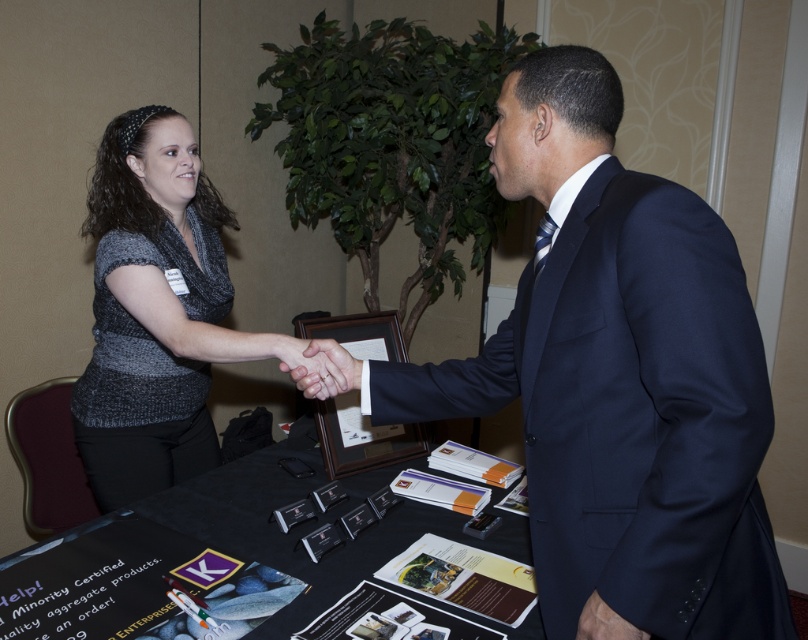
Between point (567, 289) and point (348, 381), which one is positioned in front?

Positioned in front is point (567, 289).

Is dark blue suit at center bigger than smooth skin handshake at center?

Indeed, dark blue suit at center has a larger size compared to smooth skin handshake at center.

Where is `dark blue suit at center`? dark blue suit at center is located at coordinates (619, 376).

The image size is (808, 640). Find the location of `dark blue suit at center`. dark blue suit at center is located at coordinates (619, 376).

Does dark blue suit at center lie in front of dark blue fabric at lower right?

Yes, it is in front of dark blue fabric at lower right.

Describe the element at coordinates (619, 376) in the screenshot. I see `dark blue suit at center` at that location.

I want to click on dark blue suit at center, so click(x=619, y=376).

Is knit sweater at center shorter than smooth skin handshake at center?

In fact, knit sweater at center may be taller than smooth skin handshake at center.

Which of these two, knit sweater at center or smooth skin handshake at center, stands shorter?

Standing shorter between the two is smooth skin handshake at center.

Who is more distant from viewer, [93,332] or [322,385]?

The point [93,332] is behind.

Find the location of a particular element. The image size is (808, 640). knit sweater at center is located at coordinates (154, 310).